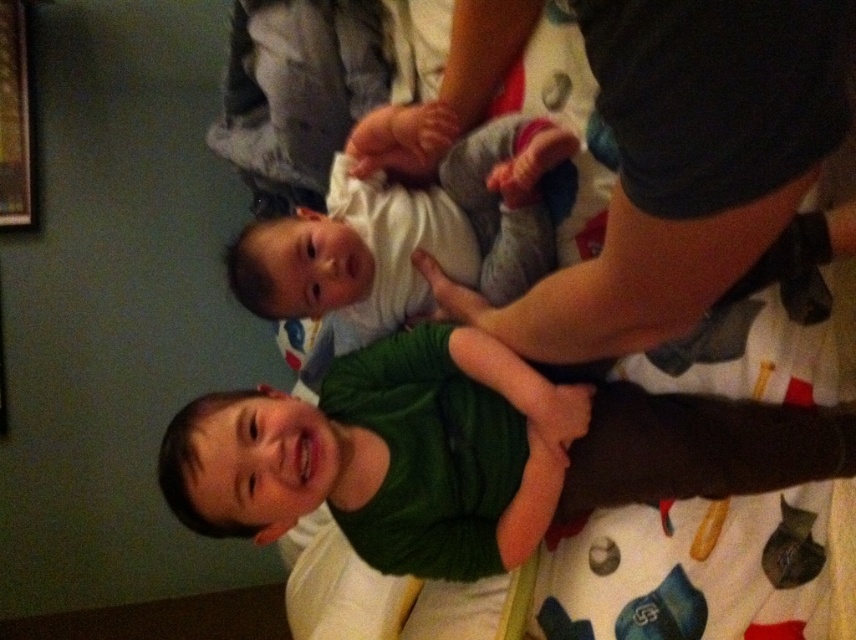
You are a photographer trying to capture a closeup of the green matte shirt at center. Given that your camera has a focus range of 0.5 meters to 1.5 meters, and the shirt is located at coordinates 0.711 on the x and 0.548 on the y axis, can you estimate if it will be within the focus range?

The green matte shirt at center is located at coordinates 0.711 on the x and 0.548 on the y axis, so it will be within the focus range of 0.5 meters to 1.5 meters.

You are a photographer trying to capture a photo of the white soft baby at center and the green matte shirt at center. From the perspective of the camera, which object is positioned to the left?

The white soft baby at center is positioned to the left of the green matte shirt at center.